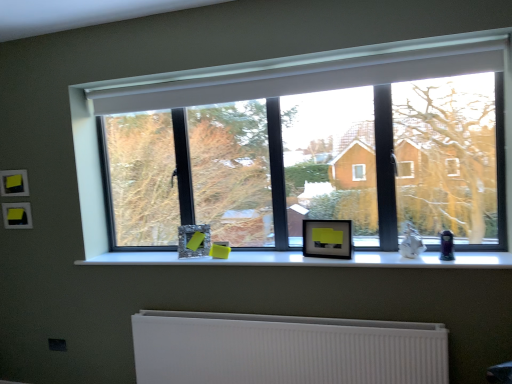
Question: Is white ribbed radiator at lower center looking in the opposite direction of matte glass picture frame at center, the 1th picture frame from the back?

Choices:
 (A) yes
 (B) no

Answer: (B)

Question: Is white ribbed radiator at lower center thinner than matte glass picture frame at center, which ranks as the second picture frame in right-to-left order?

Choices:
 (A) no
 (B) yes

Answer: (A)

Question: From the image's perspective, does white ribbed radiator at lower center appear lower than matte glass picture frame at center, arranged as the second picture frame when viewed from the front?

Choices:
 (A) yes
 (B) no

Answer: (A)

Question: Is white ribbed radiator at lower center to the right of matte glass picture frame at center, the 1th picture frame from the back, from the viewer's perspective?

Choices:
 (A) no
 (B) yes

Answer: (B)

Question: Can you confirm if white ribbed radiator at lower center is shorter than matte glass picture frame at center, the 1th picture frame from the back?

Choices:
 (A) no
 (B) yes

Answer: (A)

Question: Is point (x=202, y=251) closer or farther from the camera than point (x=133, y=254)?

Choices:
 (A) closer
 (B) farther

Answer: (A)

Question: From the image's perspective, relative to white matte window sill at center, is matte glass picture frame at center, which ranks as the 1th picture frame in left-to-right order, above or below?

Choices:
 (A) below
 (B) above

Answer: (B)

Question: In terms of size, does matte glass picture frame at center, which ranks as the 1th picture frame in left-to-right order, appear bigger or smaller than white matte window sill at center?

Choices:
 (A) big
 (B) small

Answer: (B)

Question: Looking at their shapes, would you say matte glass picture frame at center, the 1th picture frame from the back, is wider or thinner than white matte window sill at center?

Choices:
 (A) thin
 (B) wide

Answer: (A)

Question: From the image's perspective, relative to transparent glass window at center, is matte glass picture frame at center, the 1th picture frame from the back, above or below?

Choices:
 (A) below
 (B) above

Answer: (A)

Question: Considering the positions of matte glass picture frame at center, arranged as the second picture frame when viewed from the front, and transparent glass window at center in the image, is matte glass picture frame at center, arranged as the second picture frame when viewed from the front, wider or thinner than transparent glass window at center?

Choices:
 (A) thin
 (B) wide

Answer: (B)

Question: Visually, is matte glass picture frame at center, which ranks as the second picture frame in right-to-left order, positioned to the left or to the right of transparent glass window at center?

Choices:
 (A) right
 (B) left

Answer: (B)

Question: From a real-world perspective, is matte glass picture frame at center, which ranks as the second picture frame in right-to-left order, positioned above or below transparent glass window at center?

Choices:
 (A) above
 (B) below

Answer: (B)

Question: Is white matte window sill at center situated inside white ribbed radiator at lower center or outside?

Choices:
 (A) inside
 (B) outside

Answer: (B)

Question: Is point (236, 256) positioned closer to the camera than point (367, 344)?

Choices:
 (A) closer
 (B) farther

Answer: (B)